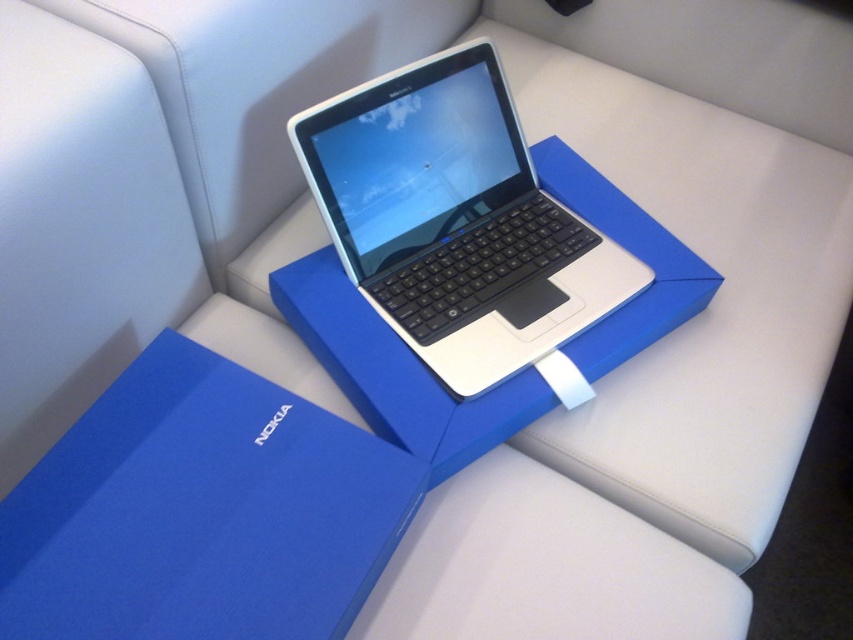
Which is in front, point (212, 550) or point (489, 376)?

Positioned in front is point (212, 550).

Can you confirm if blue matte cardboard box at center is shorter than white glossy laptop at center?

Indeed, blue matte cardboard box at center has a lesser height compared to white glossy laptop at center.

Between point (231, 484) and point (491, 70), which one is positioned in front?

Point (231, 484) is more forward.

Find the location of `blue matte cardboard box at center`. blue matte cardboard box at center is located at coordinates (201, 512).